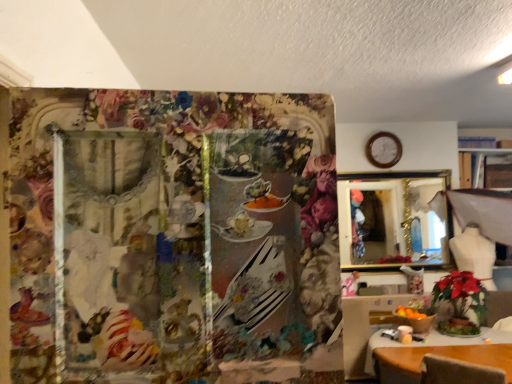
Question: Should I look upward or downward to see wooden clock at upper right?

Choices:
 (A) up
 (B) down

Answer: (A)

Question: Is wooden clock at upper right facing away from gold-framed mirror at upper right?

Choices:
 (A) no
 (B) yes

Answer: (A)

Question: Is wooden clock at upper right completely or partially outside of gold-framed mirror at upper right?

Choices:
 (A) no
 (B) yes

Answer: (B)

Question: Could you tell me if wooden clock at upper right is facing gold-framed mirror at upper right?

Choices:
 (A) no
 (B) yes

Answer: (A)

Question: From a real-world perspective, is wooden clock at upper right under gold-framed mirror at upper right?

Choices:
 (A) yes
 (B) no

Answer: (B)

Question: Is the surface of wooden clock at upper right in direct contact with gold-framed mirror at upper right?

Choices:
 (A) no
 (B) yes

Answer: (A)

Question: Can you confirm if wooden clock at upper right is smaller than gold-framed mirror at upper right?

Choices:
 (A) yes
 (B) no

Answer: (A)

Question: Considering the relative sizes of gold-framed mirror at upper right and wooden table at lower right, which is the second table in front-to-back order, in the image provided, is gold-framed mirror at upper right smaller than wooden table at lower right, which is the second table in front-to-back order,?

Choices:
 (A) yes
 (B) no

Answer: (A)

Question: Is gold-framed mirror at upper right not close to wooden table at lower right, which appears as the second table when viewed from the right?

Choices:
 (A) yes
 (B) no

Answer: (B)

Question: From a real-world perspective, is gold-framed mirror at upper right beneath wooden table at lower right, which is counted as the 1th table, starting from the back?

Choices:
 (A) yes
 (B) no

Answer: (B)

Question: Is wooden table at lower right, which is counted as the 1th table, starting from the back, surrounded by gold-framed mirror at upper right?

Choices:
 (A) no
 (B) yes

Answer: (A)

Question: Is gold-framed mirror at upper right with wooden table at lower right, which is the second table in front-to-back order?

Choices:
 (A) yes
 (B) no

Answer: (B)

Question: Considering the relative positions of gold-framed mirror at upper right and wooden table at lower right, which appears as the second table when viewed from the right, in the image provided, is gold-framed mirror at upper right to the right of wooden table at lower right, which appears as the second table when viewed from the right, from the viewer's perspective?

Choices:
 (A) yes
 (B) no

Answer: (A)

Question: Is wooden table at lower right, arranged as the second table when viewed from the back, facing towards gold-framed mirror at upper right?

Choices:
 (A) no
 (B) yes

Answer: (A)